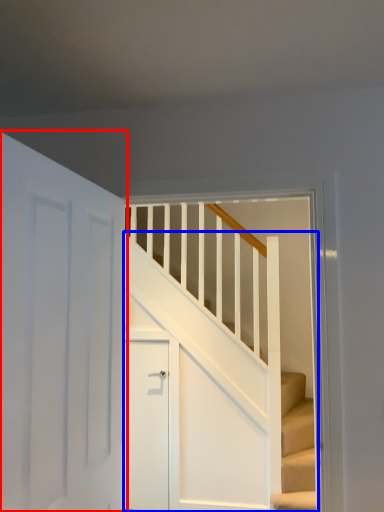
Question: Which object appears farthest to the camera in this image, door (highlighted by a red box) or stairs (highlighted by a blue box)?

Choices:
 (A) door
 (B) stairs

Answer: (B)